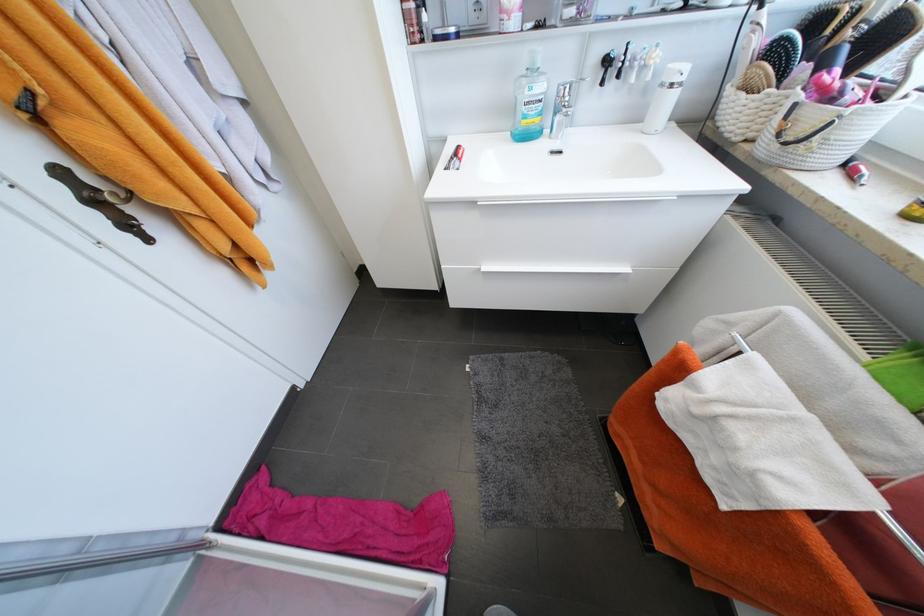
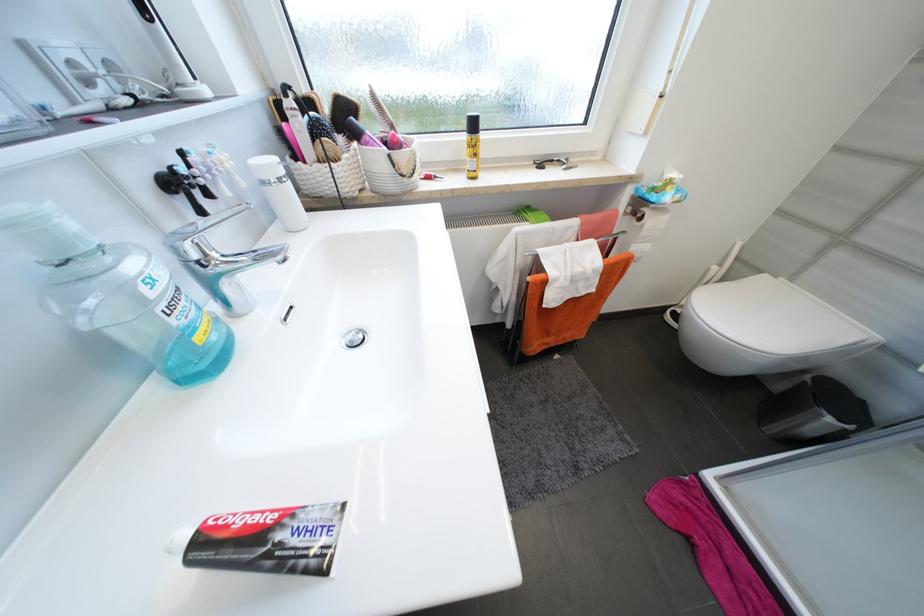
Based on the continuous images, in which direction is the camera rotating?

The rotation direction of the camera is right-down.